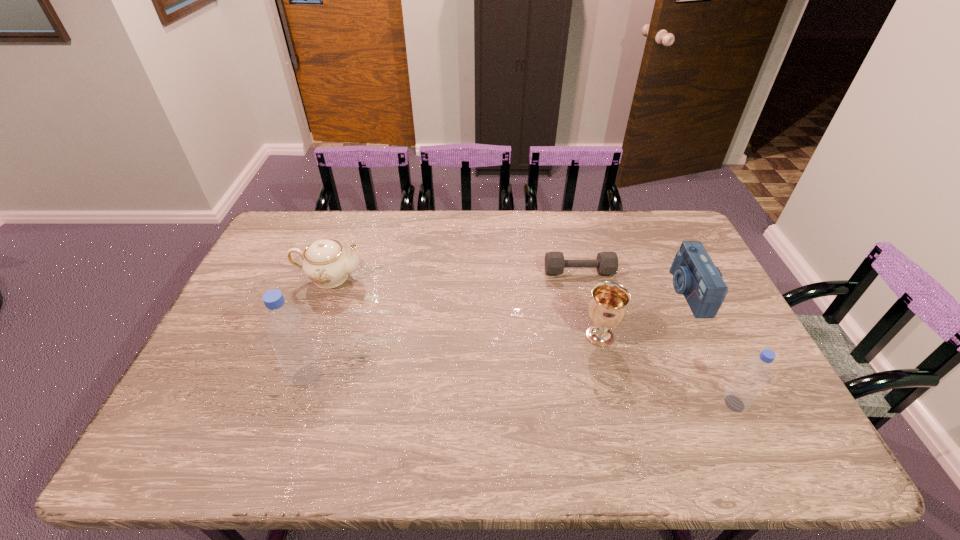
Where is `the taller bottle`? The image size is (960, 540). the taller bottle is located at coordinates (301, 363).

Image resolution: width=960 pixels, height=540 pixels. What are the coordinates of `the tallest object` in the screenshot? It's located at (301, 363).

I want to click on the nearer bottle, so click(x=753, y=376).

This screenshot has width=960, height=540. What are the coordinates of `the shorter bottle` in the screenshot? It's located at (753, 376).

You are a GUI agent. You are given a task and a screenshot of the screen. Output one action in this format:
    pyautogui.click(x=<x>, y=<y>)
    Task: Click on the chinaware
    Image resolution: width=960 pixels, height=540 pixels.
    Given the screenshot: What is the action you would take?
    (325, 262)

Image resolution: width=960 pixels, height=540 pixels. Find the location of `the shortest object`. the shortest object is located at coordinates (606, 263).

The height and width of the screenshot is (540, 960). Find the location of `the third nearest object`. the third nearest object is located at coordinates (607, 308).

You are a GUI agent. You are given a task and a screenshot of the screen. Output one action in this format:
    pyautogui.click(x=<x>, y=<y>)
    Task: Click on the camera
    The image size is (960, 540).
    Given the screenshot: What is the action you would take?
    pyautogui.click(x=695, y=276)

Locate an element on the screen. The image size is (960, 540). free region located 0.160m on the right of the taller bottle is located at coordinates (386, 376).

This screenshot has width=960, height=540. What are the coordinates of `free region located on the back of the second tallest object` in the screenshot? It's located at (694, 319).